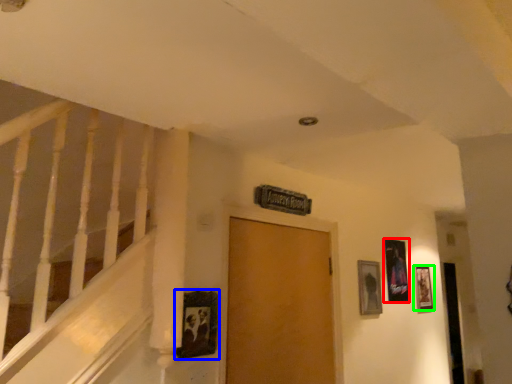
Question: Based on their relative distances, which object is farther from picture frame (highlighted by a red box)? Choose from picture frame (highlighted by a blue box) and picture frame (highlighted by a green box).

Choices:
 (A) picture frame
 (B) picture frame

Answer: (A)